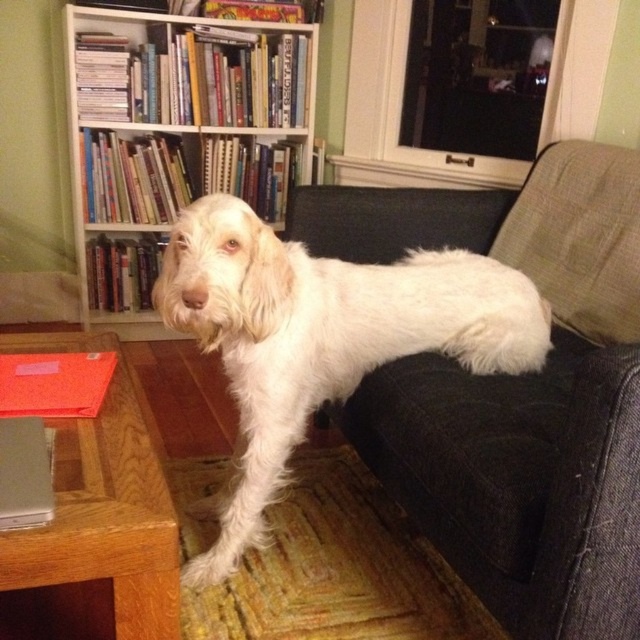
You are organizing a space and need to place a large potted plant that requires a sturdy surface. Given the white wood bookcase at upper center and the wooden table at lower left, which one is more suitable for placing the plant?

The wooden table at lower left is more suitable for placing the large potted plant because the white wood bookcase at upper center is positioned over it, meaning the table is likely lower and sturdier for supporting heavier items.

Based on the photo, you are a delivery person who needs to place a package that is 5 feet long on the floor between the white fluffy dog at center and the white wood bookcase at upper center. Is there enough space for the package?

The white fluffy dog at center is 4.20 feet away from the white wood bookcase at upper center. Since the package is 5 feet long, which is longer than the available space between them, the package cannot be placed there.

You are planning to buy a new dog bed for the white fluffy dog at center. The dog bed you want to purchase is the same width as the white wood bookcase at upper center. Will the bed be too wide for the dog?

The white fluffy dog at center is narrower than the white wood bookcase at upper center, so the bed with the same width as the bookcase would be too wide for the dog.